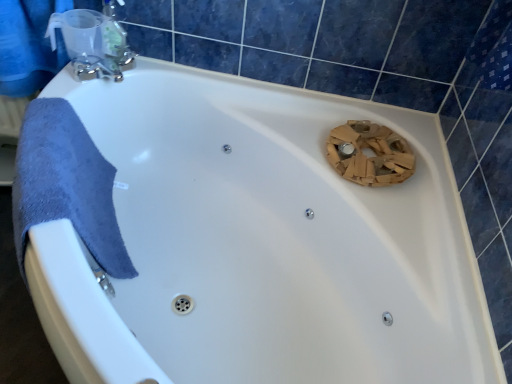
The image size is (512, 384). In order to click on satin nickel faucet at upper left in this screenshot , I will do `click(95, 43)`.

Considering the positions of point (117, 28) and point (42, 47), is point (117, 28) closer or farther from the camera than point (42, 47)?

Point (117, 28).

Is blue fabric towel at upper left at the back of clear plastic soap dispenser at upper left?

clear plastic soap dispenser at upper left does not have its back to blue fabric towel at upper left.

Based on the photo, is clear plastic soap dispenser at upper left to the right of blue fabric towel at upper left from the viewer's perspective?

Yes.

Between clear plastic soap dispenser at upper left and blue fabric towel at upper left, which one has more height?

With more height is blue fabric towel at upper left.

Does point (112, 4) come farther from viewer compared to point (113, 22)?

No, it is in front of (113, 22).

Considering the relative sizes of clear plastic soap dispenser at upper left and satin nickel faucet at upper left in the image provided, is clear plastic soap dispenser at upper left thinner than satin nickel faucet at upper left?

Correct, the width of clear plastic soap dispenser at upper left is less than that of satin nickel faucet at upper left.

Which object is positioned more to the right, clear plastic soap dispenser at upper left or satin nickel faucet at upper left?

clear plastic soap dispenser at upper left.

Is clear plastic soap dispenser at upper left surrounding satin nickel faucet at upper left?

No.

Locate an element on the screen. shower curtain below the satin nickel faucet at upper left (from a real-world perspective) is located at coordinates (28, 45).

Which of these two, blue fabric towel at upper left or satin nickel faucet at upper left, stands taller?

blue fabric towel at upper left.

Considering the points (63, 58) and (87, 48), which point is behind, point (63, 58) or point (87, 48)?

The point (63, 58) is farther.

Can you confirm if blue fabric towel at upper left is thinner than satin nickel faucet at upper left?

No, blue fabric towel at upper left is not thinner than satin nickel faucet at upper left.

Can you confirm if satin nickel faucet at upper left is positioned to the right of blue fabric towel at upper left?

Correct, you'll find satin nickel faucet at upper left to the right of blue fabric towel at upper left.

From the image's perspective, which object appears higher, satin nickel faucet at upper left or blue fabric towel at upper left?

From the image's view, blue fabric towel at upper left is above.

Who is smaller, satin nickel faucet at upper left or blue fabric towel at upper left?

Smaller between the two is satin nickel faucet at upper left.

From a real-world perspective, does satin nickel faucet at upper left sit lower than blue fabric towel at upper left?

No, from a real-world perspective, satin nickel faucet at upper left is not under blue fabric towel at upper left.

The height and width of the screenshot is (384, 512). What are the coordinates of `shower curtain in front of the clear plastic soap dispenser at upper left` in the screenshot? It's located at (28, 45).

Which object is positioned more to the right, blue fabric towel at upper left or clear plastic soap dispenser at upper left?

clear plastic soap dispenser at upper left is more to the right.

Is blue fabric towel at upper left bigger than clear plastic soap dispenser at upper left?

Indeed, blue fabric towel at upper left has a larger size compared to clear plastic soap dispenser at upper left.

Are blue fabric towel at upper left and clear plastic soap dispenser at upper left making contact?

There is a gap between blue fabric towel at upper left and clear plastic soap dispenser at upper left.

Would you consider satin nickel faucet at upper left to be distant from clear plastic soap dispenser at upper left?

No, there isn't a large distance between satin nickel faucet at upper left and clear plastic soap dispenser at upper left.

Is satin nickel faucet at upper left inside the boundaries of clear plastic soap dispenser at upper left, or outside?

satin nickel faucet at upper left lies outside clear plastic soap dispenser at upper left.

Between satin nickel faucet at upper left and clear plastic soap dispenser at upper left, which one has more height?

clear plastic soap dispenser at upper left.

Is satin nickel faucet at upper left positioned behind clear plastic soap dispenser at upper left?

Yes, it is behind clear plastic soap dispenser at upper left.

Where is `shower curtain that appears in front of the clear plastic soap dispenser at upper left`? shower curtain that appears in front of the clear plastic soap dispenser at upper left is located at coordinates (28, 45).

Find the location of a particular element. The width and height of the screenshot is (512, 384). toiletry lying above the satin nickel faucet at upper left (from the image's perspective) is located at coordinates (113, 31).

From the image, which object appears to be nearer to clear plastic soap dispenser at upper left, satin nickel faucet at upper left or blue fabric towel at upper left?

satin nickel faucet at upper left lies closer to clear plastic soap dispenser at upper left than the other object.

Based on their spatial positions, is blue fabric towel at upper left or clear plastic soap dispenser at upper left further from satin nickel faucet at upper left?

Based on the image, blue fabric towel at upper left appears to be further to satin nickel faucet at upper left.

Looking at the image, which one is located closer to blue fabric towel at upper left, clear plastic soap dispenser at upper left or satin nickel faucet at upper left?

satin nickel faucet at upper left.

Which object lies further to the anchor point satin nickel faucet at upper left, clear plastic soap dispenser at upper left or blue fabric towel at upper left?

blue fabric towel at upper left is positioned further to the anchor satin nickel faucet at upper left.

Looking at the image, which one is located closer to blue fabric towel at upper left, satin nickel faucet at upper left or clear plastic soap dispenser at upper left?

Among the two, satin nickel faucet at upper left is located nearer to blue fabric towel at upper left.

From the image, which object appears to be farther from clear plastic soap dispenser at upper left, blue fabric towel at upper left or satin nickel faucet at upper left?

Among the two, blue fabric towel at upper left is located further to clear plastic soap dispenser at upper left.

Identify the location of tap between blue fabric towel at upper left and clear plastic soap dispenser at upper left in the horizontal direction. The width and height of the screenshot is (512, 384). (95, 43).